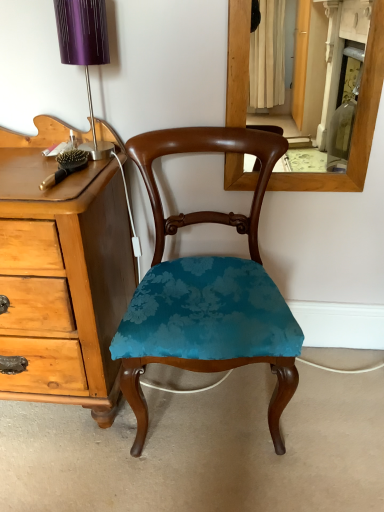
The image size is (384, 512). Describe the element at coordinates (207, 288) in the screenshot. I see `teal velvet chair at center` at that location.

Consider the image. In order to face teal velvet chair at center, should I rotate leftwards or rightwards?

Turn right by 2.526 degrees to look at teal velvet chair at center.

Locate an element on the screen. The width and height of the screenshot is (384, 512). teal velvet chair at center is located at coordinates (207, 288).

Identify the location of purple metallic table lamp at upper left. The height and width of the screenshot is (512, 384). (84, 49).

Describe the element at coordinates (84, 49) in the screenshot. The image size is (384, 512). I see `purple metallic table lamp at upper left` at that location.

Locate an element on the screen. The image size is (384, 512). teal velvet chair at center is located at coordinates (207, 288).

Between teal velvet chair at center and purple metallic table lamp at upper left, which one appears on the left side from the viewer's perspective?

purple metallic table lamp at upper left.

Which object is closer to the camera, teal velvet chair at center or purple metallic table lamp at upper left?

teal velvet chair at center is closer to the camera.

Which is closer, (277, 448) or (55, 7)?

The point (55, 7) is more forward.

From the picture: From the image's perspective, which one is positioned higher, teal velvet chair at center or purple metallic table lamp at upper left?

purple metallic table lamp at upper left.

From a real-world perspective, is teal velvet chair at center located beneath purple metallic table lamp at upper left?

Yes, from a real-world perspective, teal velvet chair at center is beneath purple metallic table lamp at upper left.

Between teal velvet chair at center and purple metallic table lamp at upper left, which one has larger width?

teal velvet chair at center.

From their relative heights in the image, would you say teal velvet chair at center is taller or shorter than purple metallic table lamp at upper left?

Considering their sizes, teal velvet chair at center has more height than purple metallic table lamp at upper left.

Does teal velvet chair at center have a smaller size compared to purple metallic table lamp at upper left?

Actually, teal velvet chair at center might be larger than purple metallic table lamp at upper left.

Looking at this image, is purple metallic table lamp at upper left a part of teal velvet chair at center?

Actually, purple metallic table lamp at upper left is outside teal velvet chair at center.

Is teal velvet chair at center touching purple metallic table lamp at upper left?

No, teal velvet chair at center is not beside purple metallic table lamp at upper left.

Is teal velvet chair at center positioned with its back to purple metallic table lamp at upper left?

teal velvet chair at center does not have its back to purple metallic table lamp at upper left.

What's the angular difference between teal velvet chair at center and purple metallic table lamp at upper left's facing directions?

teal velvet chair at center and purple metallic table lamp at upper left are facing 0.761 degrees away from each other.

Find the location of `table lamp behind the teal velvet chair at center`. table lamp behind the teal velvet chair at center is located at coordinates (84, 49).

Which object is positioned more to the left, purple metallic table lamp at upper left or teal velvet chair at center?

Positioned to the left is purple metallic table lamp at upper left.

Relative to teal velvet chair at center, is purple metallic table lamp at upper left in front or behind?

purple metallic table lamp at upper left is positioned farther from the viewer than teal velvet chair at center.

Does point (88, 14) come farther from viewer compared to point (137, 437)?

No, it is not.

From the image's perspective, is purple metallic table lamp at upper left positioned above or below teal velvet chair at center?

purple metallic table lamp at upper left is situated higher than teal velvet chair at center in the image.

From a real-world perspective, is purple metallic table lamp at upper left positioned above or below teal velvet chair at center?

From a real-world perspective, purple metallic table lamp at upper left is physically above teal velvet chair at center.

Which object is wider, purple metallic table lamp at upper left or teal velvet chair at center?

Wider between the two is teal velvet chair at center.

Considering the relative sizes of purple metallic table lamp at upper left and teal velvet chair at center in the image provided, is purple metallic table lamp at upper left taller than teal velvet chair at center?

In fact, purple metallic table lamp at upper left may be shorter than teal velvet chair at center.

Considering the sizes of objects purple metallic table lamp at upper left and teal velvet chair at center in the image provided, who is bigger, purple metallic table lamp at upper left or teal velvet chair at center?

teal velvet chair at center is bigger.

Which is correct: purple metallic table lamp at upper left is inside teal velvet chair at center, or outside of it?

purple metallic table lamp at upper left is not inside teal velvet chair at center, it's outside.

Consider the image. Is there a large distance between purple metallic table lamp at upper left and teal velvet chair at center?

They are positioned close to each other.

Is purple metallic table lamp at upper left facing away from teal velvet chair at center?

That's not correct — purple metallic table lamp at upper left is not looking away from teal velvet chair at center.

The height and width of the screenshot is (512, 384). I want to click on chair on the right of the purple metallic table lamp at upper left, so click(x=207, y=288).

Image resolution: width=384 pixels, height=512 pixels. In order to click on table lamp to the left of teal velvet chair at center in this screenshot , I will do [x=84, y=49].

Identify the location of chair that is below the purple metallic table lamp at upper left (from the image's perspective). The width and height of the screenshot is (384, 512). (207, 288).